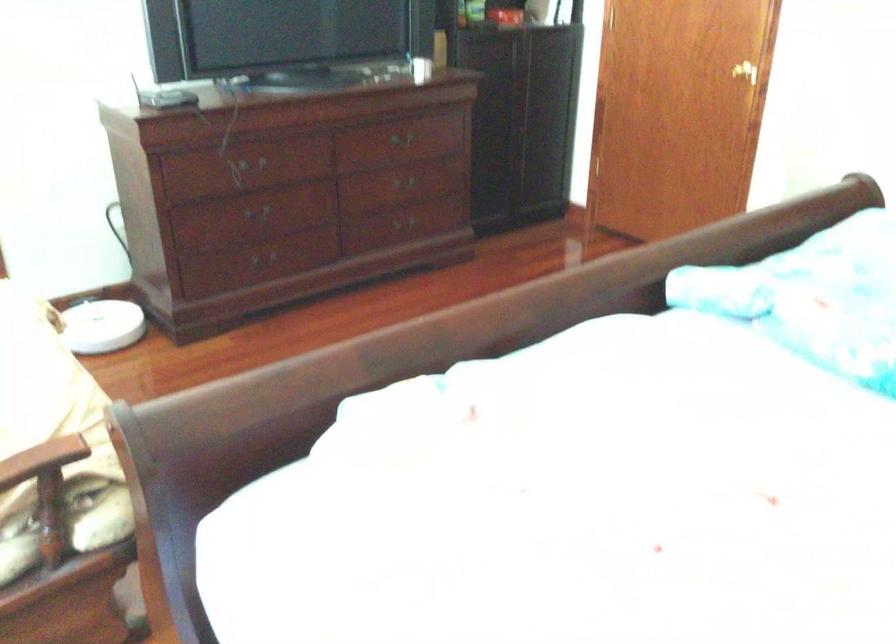
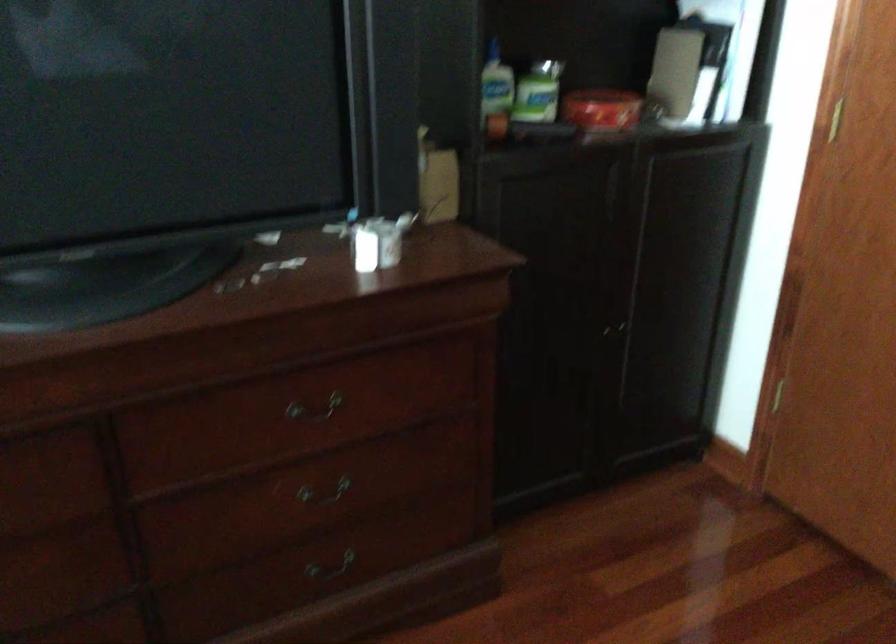
Locate, in the second image, the point that corresponds to (x=398, y=225) in the first image.

(330, 567)